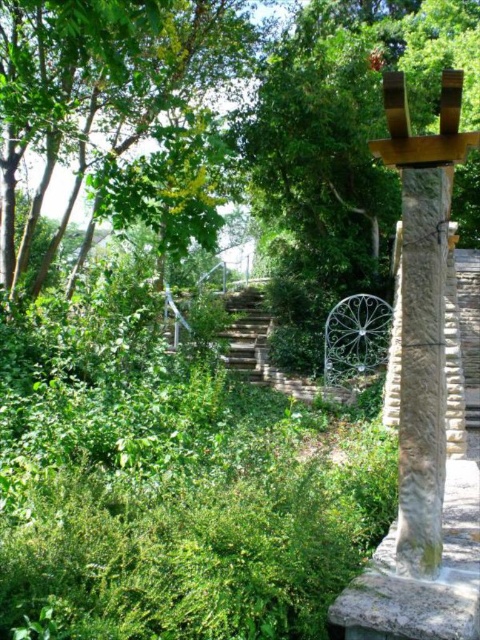
You are standing at the starting point of the stone pathway in the garden. You notice two points marked on the path ahead. The first point is at coordinates point (423, 262) and the second is at point (472, 355). If you walk straight along the path, which point will you encounter first?

You will encounter point (423, 262) first because it is positioned in front of point (472, 355) along the path.

You are a gardener planning to plant a new tree in the garden. You notice the green leafy tree at center and the smooth concrete stairs at center. Which object takes up more space in the scene?

The green leafy tree at center is bigger than the smooth concrete stairs at center, so it takes up more space in the scene.